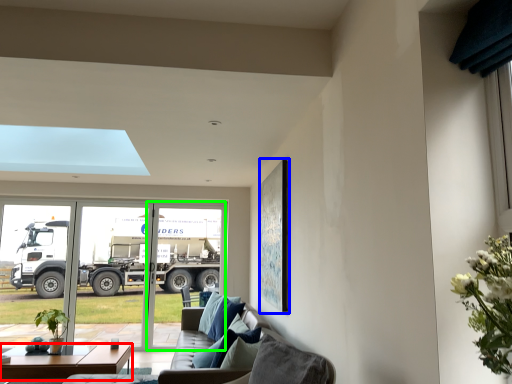
Question: Which object is the closest to the table (highlighted by a red box)? Choose among these: picture frame (highlighted by a blue box) or screen door (highlighted by a green box).

Choices:
 (A) picture frame
 (B) screen door

Answer: (A)